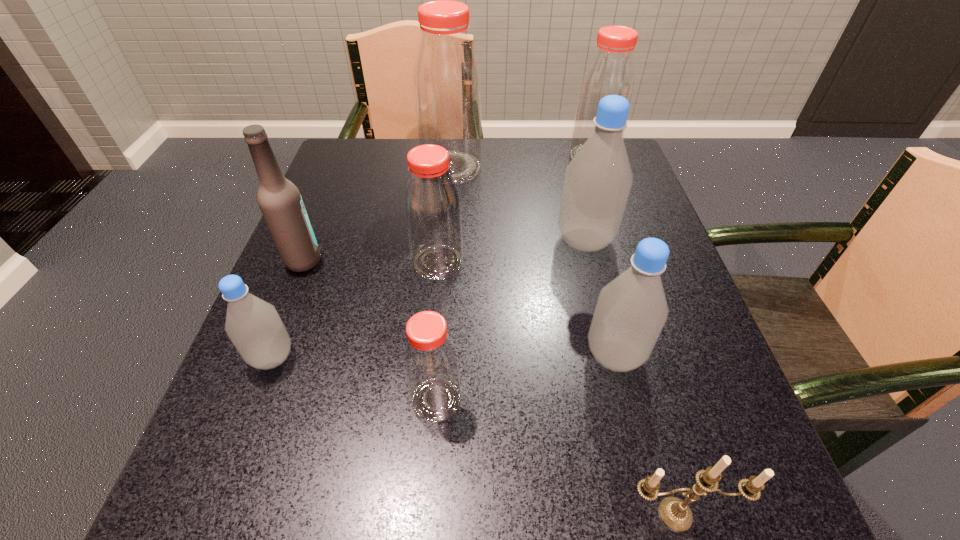
Image resolution: width=960 pixels, height=540 pixels. What are the coordinates of `empty location between the leftmost bottle and the biggest gray bottle` in the screenshot? It's located at (428, 299).

Find the location of a particular element. The image size is (960, 540). empty space that is in between the second smallest red bottle and the rightmost red bottle is located at coordinates (516, 210).

The width and height of the screenshot is (960, 540). I want to click on vacant area between the beer bottle and the tallest object, so click(377, 214).

Select which object is the third closest to the third farthest red bottle. Please provide its 2D coordinates. Your answer should be formatted as a tuple, i.e. [(x, y)], where the tuple contains the x and y coordinates of a point satisfying the conditions above.

[(430, 358)]

You are a GUI agent. You are given a task and a screenshot of the screen. Output one action in this format:
    pyautogui.click(x=<x>, y=<y>)
    Task: Click on the object that is the sixth closest to the beer bottle
    
    Given the screenshot: What is the action you would take?
    pyautogui.click(x=631, y=311)

Identify which bottle is located as the nearest to the smallest gray bottle. Please provide its 2D coordinates. Your answer should be formatted as a tuple, i.e. [(x, y)], where the tuple contains the x and y coordinates of a point satisfying the conditions above.

[(430, 358)]

Select which bottle appears as the closest to the nearest red bottle. Please provide its 2D coordinates. Your answer should be formatted as a tuple, i.e. [(x, y)], where the tuple contains the x and y coordinates of a point satisfying the conditions above.

[(254, 326)]

Identify the location of the fourth closest red bottle to the leftmost bottle. (611, 71).

Identify which red bottle is the nearest to the nearest red bottle. Please provide its 2D coordinates. Your answer should be formatted as a tuple, i.e. [(x, y)], where the tuple contains the x and y coordinates of a point satisfying the conditions above.

[(432, 207)]

Locate which gray bottle is the second closest to the second smallest gray bottle. Please provide its 2D coordinates. Your answer should be formatted as a tuple, i.e. [(x, y)], where the tuple contains the x and y coordinates of a point satisfying the conditions above.

[(254, 326)]